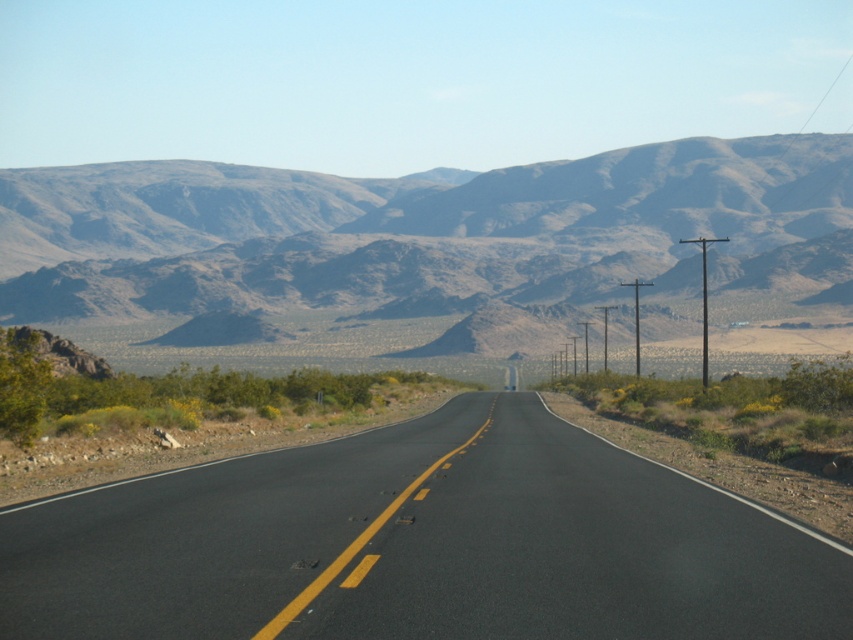
Question: Can you confirm if black asphalt road at center is positioned to the left of brown rocky mountain range at upper center?

Choices:
 (A) no
 (B) yes

Answer: (A)

Question: Is black asphalt road at center to the right of brown rocky mountain range at upper center from the viewer's perspective?

Choices:
 (A) yes
 (B) no

Answer: (A)

Question: Where is black asphalt road at center located in relation to brown rocky mountain range at upper center in the image?

Choices:
 (A) right
 (B) left

Answer: (A)

Question: Which object is farther from the camera taking this photo?

Choices:
 (A) brown rocky mountain range at upper center
 (B) black asphalt road at center

Answer: (A)